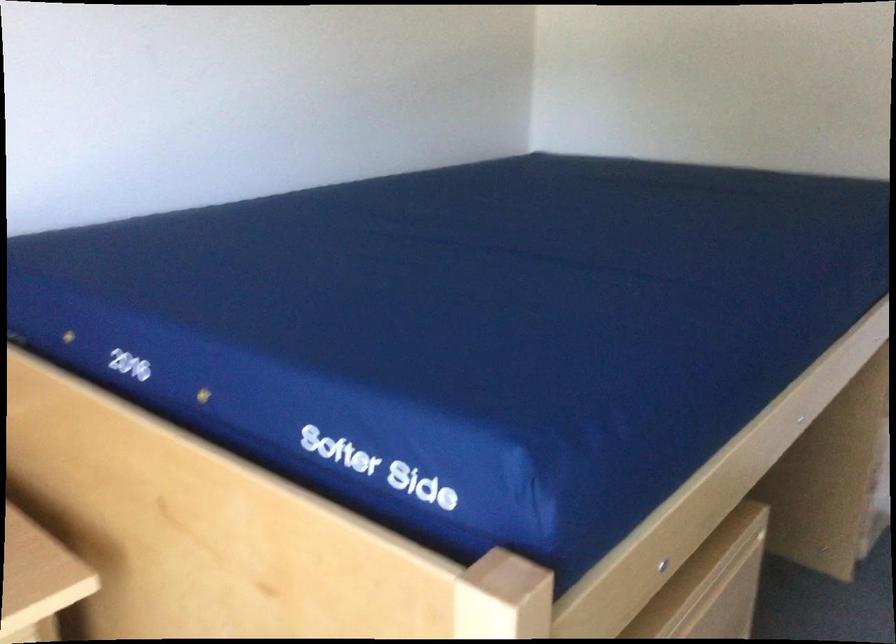
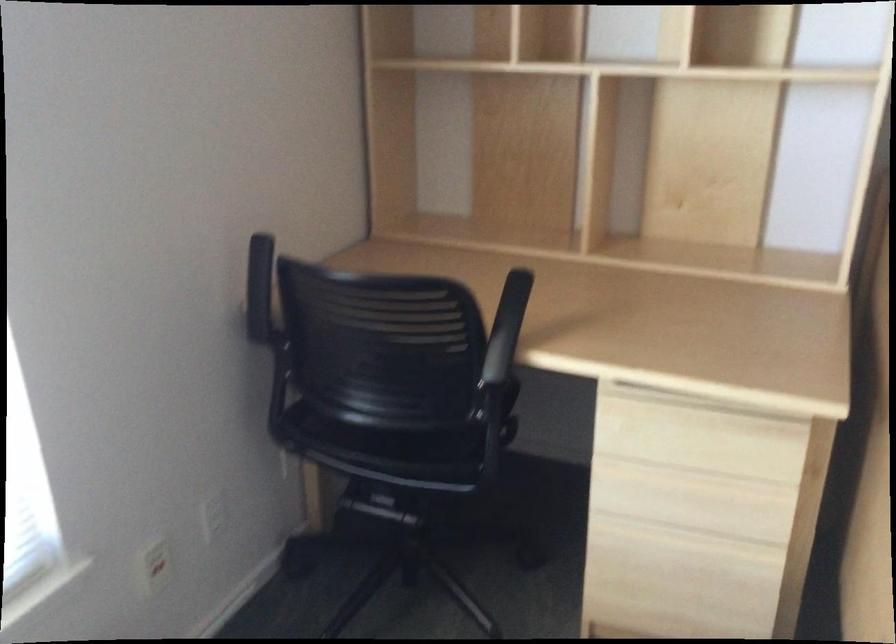
The images are taken continuously from a first-person perspective. In which direction is your viewpoint rotating?

The camera's rotation is toward left-down.